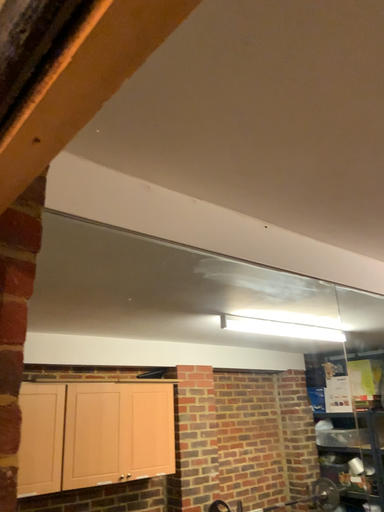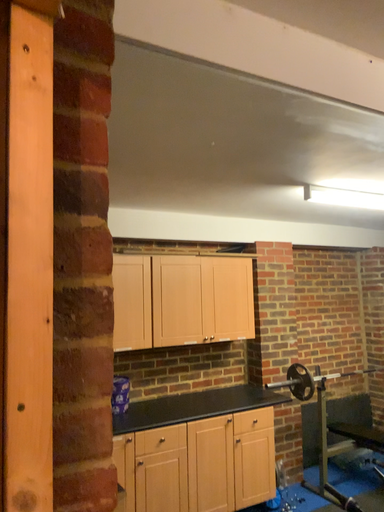
Question: How did the camera likely rotate when shooting the video?

Choices:
 (A) rotated upward
 (B) rotated downward

Answer: (B)